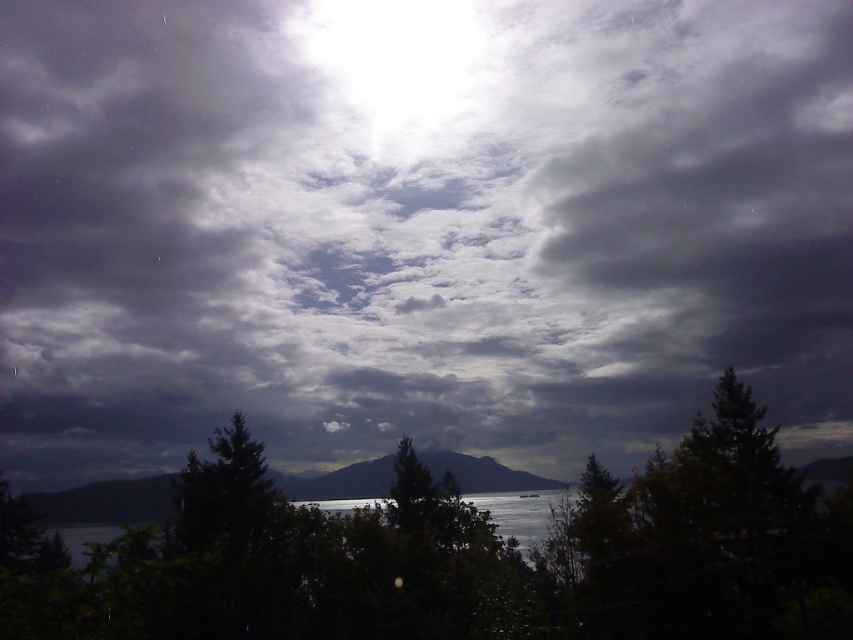
Is the position of green leafy tree at center more distant than that of dark gray rocky mountain at center?

No, it is not.

Is point (657, 564) in front of point (305, 486)?

Yes, point (657, 564) is in front of point (305, 486).

Locate an element on the screen. green leafy tree at center is located at coordinates 712,540.